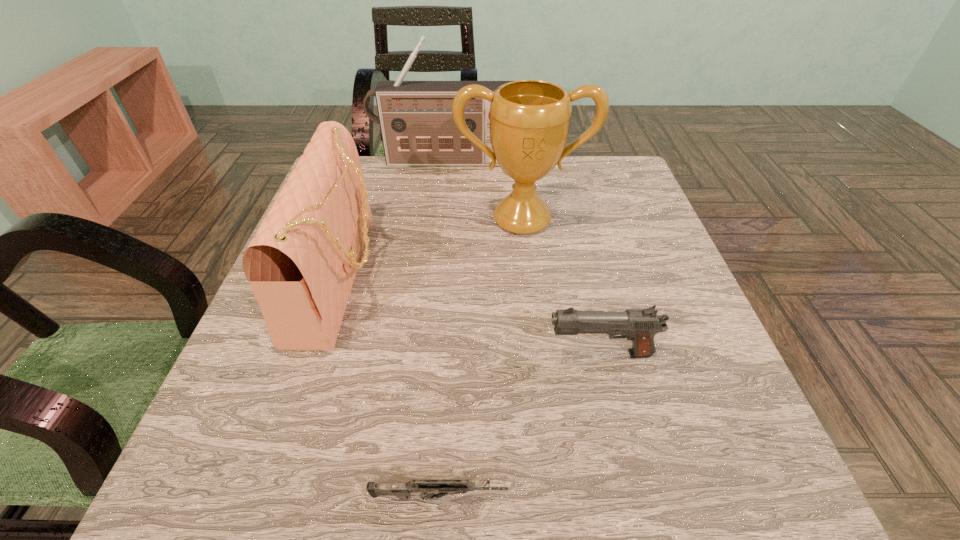
This screenshot has width=960, height=540. In order to click on gun that is at the right edge in this screenshot , I will do `click(640, 325)`.

Locate an element on the screen. The image size is (960, 540). object at the far left corner is located at coordinates (417, 127).

This screenshot has height=540, width=960. In order to click on object located at the far right corner in this screenshot , I will do `click(529, 119)`.

At what (x,y) coordinates should I click in order to perform the action: click on free space at the far edge of the desktop. Please return your answer as a coordinate pair (x, y). Looking at the image, I should click on (447, 187).

You are a GUI agent. You are given a task and a screenshot of the screen. Output one action in this format:
    pyautogui.click(x=<x>, y=<y>)
    Task: Click on the blank space at the near edge of the desktop
    This screenshot has height=540, width=960.
    Given the screenshot: What is the action you would take?
    pyautogui.click(x=573, y=488)

At what (x,y) coordinates should I click in order to perform the action: click on vacant space at the left edge of the desktop. Please return your answer as a coordinate pair (x, y). Looking at the image, I should click on [368, 235].

The width and height of the screenshot is (960, 540). What are the coordinates of `vacant space at the right edge` in the screenshot? It's located at (591, 206).

This screenshot has width=960, height=540. I want to click on vacant point at the near left corner, so click(x=267, y=500).

In the image, there is a desktop. Identify the location of vacant region at the far right corner. pyautogui.click(x=583, y=176).

What are the coordinates of `empty space that is in between the award and the right gun` in the screenshot? It's located at (561, 287).